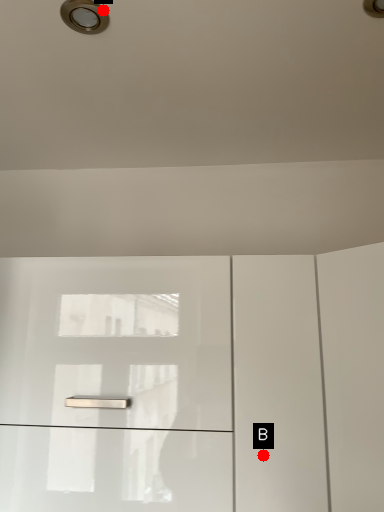
Question: Two points are circled on the image, labeled by A and B beside each circle. Which point is closer to the camera taking this photo?

Choices:
 (A) A is closer
 (B) B is closer

Answer: (A)